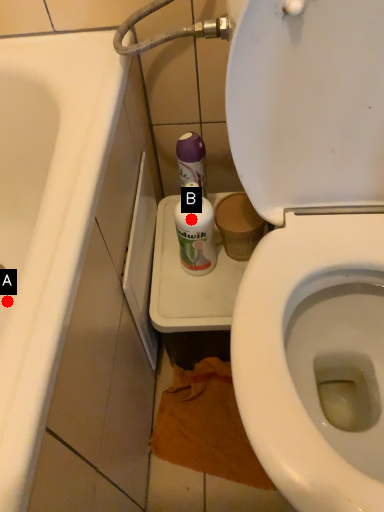
Question: Two points are circled on the image, labeled by A and B beside each circle. Among these points, which one is farthest from the camera?

Choices:
 (A) A is further
 (B) B is further

Answer: (A)